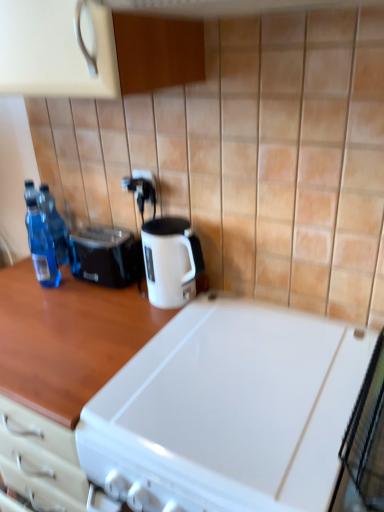
The width and height of the screenshot is (384, 512). Identify the location of vacant space in front of black plastic toaster at left. (96, 302).